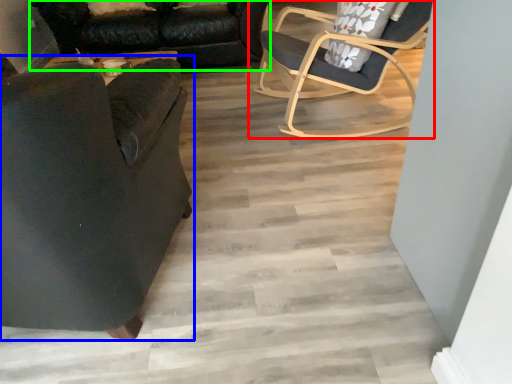
Question: Considering the real-world distances, which object is closest to chair (highlighted by a red box)? chair (highlighted by a blue box) or studio couch (highlighted by a green box).

Choices:
 (A) chair
 (B) studio couch

Answer: (B)